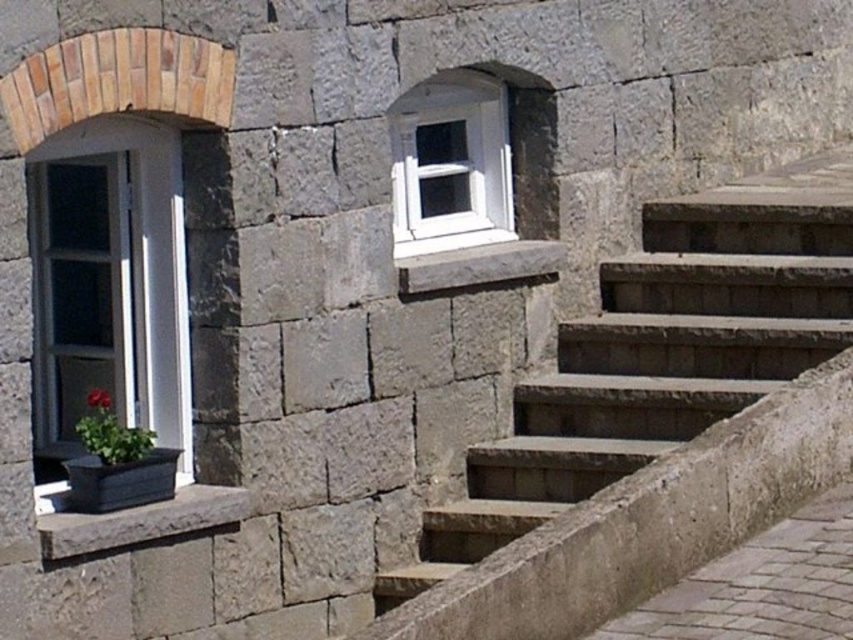
Question: Is gray stone stairs at center bigger than green matte flower at lower left?

Choices:
 (A) yes
 (B) no

Answer: (A)

Question: Is matte black planter at lower left to the left of green matte flower at lower left from the viewer's perspective?

Choices:
 (A) no
 (B) yes

Answer: (A)

Question: Which point is farther from the camera taking this photo?

Choices:
 (A) (157, 404)
 (B) (704, 291)

Answer: (B)

Question: Which is nearer to the white plastic window at upper center?

Choices:
 (A) matte black planter at lower left
 (B) green matte flower at lower left
 (C) smooth stone window sill at lower left
 (D) matte white window at left

Answer: (D)

Question: Does gray stone stairs at center have a larger size compared to smooth stone window sill at lower left?

Choices:
 (A) yes
 (B) no

Answer: (A)

Question: Which point is farther from the camera taking this photo?

Choices:
 (A) (427, 214)
 (B) (100, 403)
 (C) (160, 516)

Answer: (A)